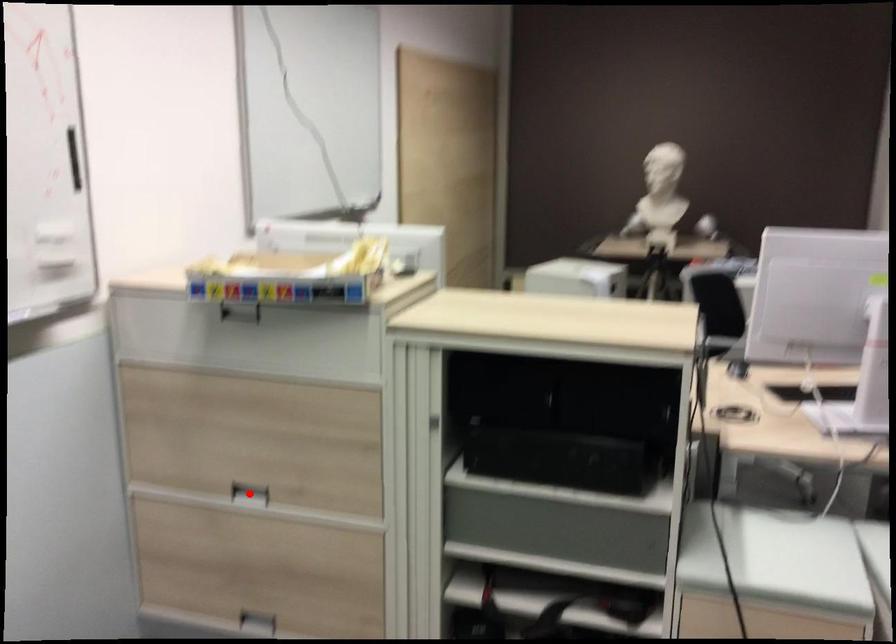
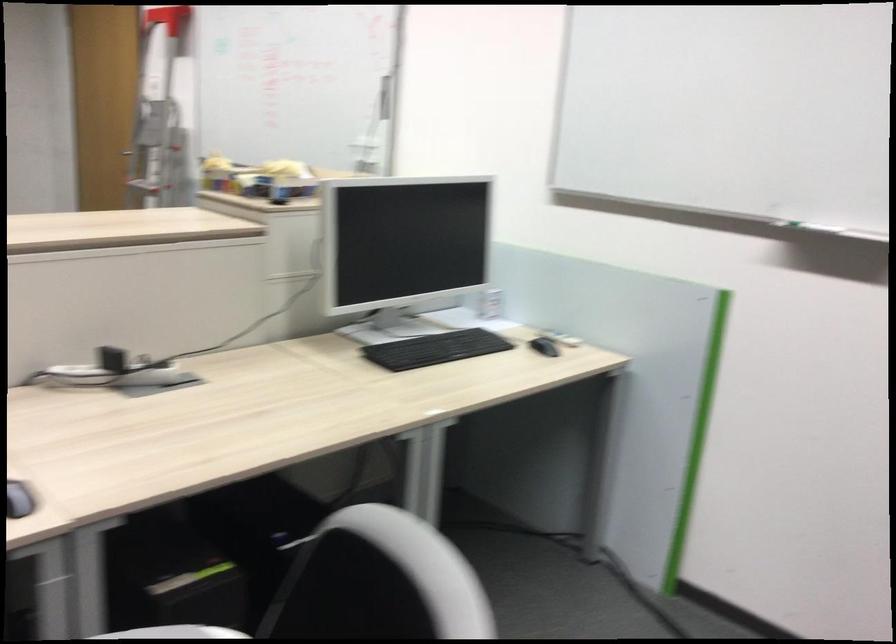
Question: I am providing you with two images of the same scene from different viewpoints. A red point is marked on the first image. Can you still see the location of the red point in image 2?

Choices:
 (A) Yes
 (B) No

Answer: (B)